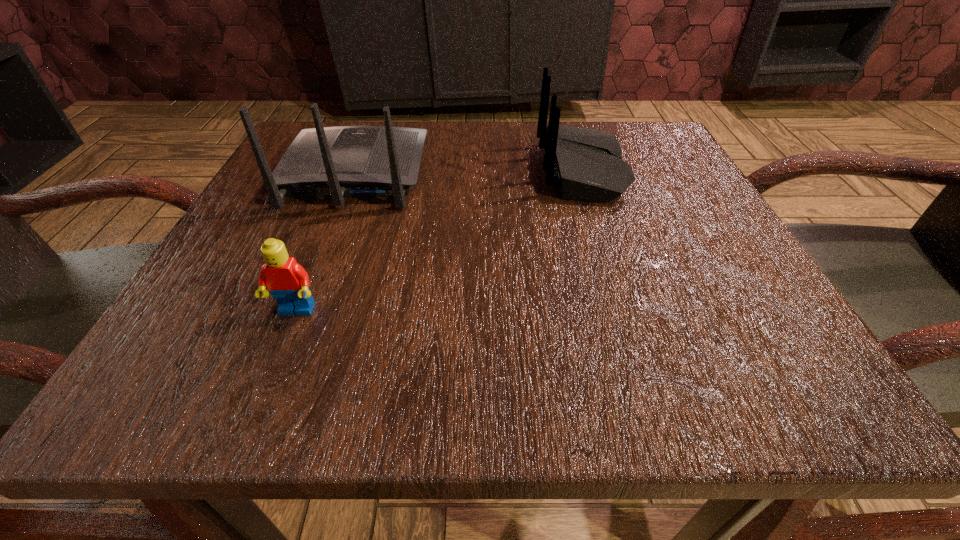
Find the location of a particular element. This screenshot has width=960, height=540. router situated at the left edge is located at coordinates (345, 161).

You are a GUI agent. You are given a task and a screenshot of the screen. Output one action in this format:
    pyautogui.click(x=<x>, y=<y>)
    Task: Click on the Lego that is positioned at the left edge
    The width and height of the screenshot is (960, 540).
    Given the screenshot: What is the action you would take?
    pyautogui.click(x=287, y=281)

Find the location of a particular element. Image resolution: width=960 pixels, height=540 pixels. object at the right edge is located at coordinates (587, 164).

Find the location of a particular element. This screenshot has height=540, width=960. object at the far left corner is located at coordinates click(x=345, y=161).

At what (x,y) coordinates should I click in order to perform the action: click on object positioned at the far right corner. Please return your answer as a coordinate pair (x, y). The width and height of the screenshot is (960, 540). Looking at the image, I should click on (587, 164).

This screenshot has height=540, width=960. What are the coordinates of `vacant space at the far edge` in the screenshot? It's located at (473, 141).

In the image, there is a desktop. At what (x,y) coordinates should I click in order to perform the action: click on vacant space at the near edge. Please return your answer as a coordinate pair (x, y). This screenshot has width=960, height=540. Looking at the image, I should click on (454, 350).

In the image, there is a desktop. Where is `vacant space at the left edge`? vacant space at the left edge is located at coordinates (190, 328).

Identify the location of free space at the right edge of the desktop. (669, 307).

This screenshot has height=540, width=960. I want to click on vacant space at the far left corner of the desktop, so [353, 123].